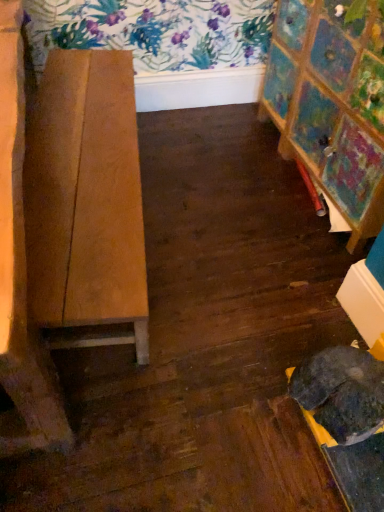
Question: From a real-world perspective, is wooden table at left beneath painted wood easel at right?

Choices:
 (A) no
 (B) yes

Answer: (B)

Question: Is wooden table at left at the left side of painted wood easel at right?

Choices:
 (A) no
 (B) yes

Answer: (B)

Question: Can you confirm if wooden table at left is smaller than painted wood easel at right?

Choices:
 (A) yes
 (B) no

Answer: (B)

Question: From the image's perspective, is wooden table at left above painted wood easel at right?

Choices:
 (A) yes
 (B) no

Answer: (B)

Question: Can you confirm if wooden table at left is bigger than painted wood easel at right?

Choices:
 (A) yes
 (B) no

Answer: (A)

Question: Is wooden table at left positioned in front of painted wood easel at right?

Choices:
 (A) no
 (B) yes

Answer: (B)

Question: Does painted wood easel at right have a greater height compared to wooden table at left?

Choices:
 (A) yes
 (B) no

Answer: (A)

Question: Can you confirm if painted wood easel at right is positioned to the right of wooden table at left?

Choices:
 (A) yes
 (B) no

Answer: (A)

Question: Is painted wood easel at right bigger than wooden table at left?

Choices:
 (A) yes
 (B) no

Answer: (B)

Question: From the image's perspective, is painted wood easel at right under wooden table at left?

Choices:
 (A) no
 (B) yes

Answer: (A)

Question: Considering the relative positions of painted wood easel at right and wooden table at left in the image provided, is painted wood easel at right behind wooden table at left?

Choices:
 (A) yes
 (B) no

Answer: (A)

Question: From the image's perspective, is painted wood easel at right on wooden table at left?

Choices:
 (A) yes
 (B) no

Answer: (A)

Question: Is point (71, 234) closer or farther from the camera than point (321, 183)?

Choices:
 (A) closer
 (B) farther

Answer: (A)